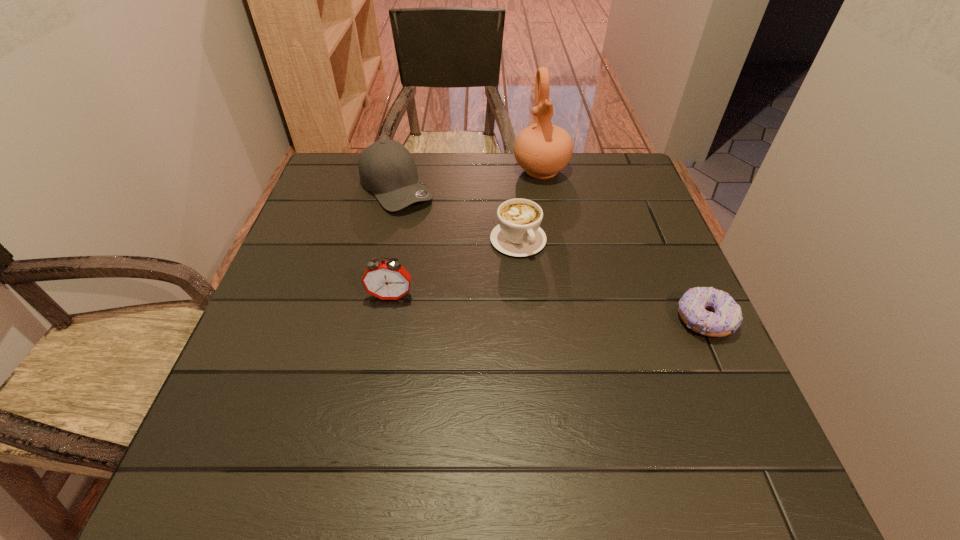
At what (x,y) coordinates should I click in order to perform the action: click on object that is positioned at the left edge. Please return your answer as a coordinate pair (x, y). The height and width of the screenshot is (540, 960). Looking at the image, I should click on (387, 169).

Where is `object that is at the right edge`? object that is at the right edge is located at coordinates (725, 317).

Image resolution: width=960 pixels, height=540 pixels. Identify the location of object present at the far left corner. (387, 169).

Locate an element on the screen. free space at the near edge is located at coordinates (571, 413).

The width and height of the screenshot is (960, 540). In the image, there is a desktop. What are the coordinates of `blank space at the left edge` in the screenshot? It's located at (271, 364).

The width and height of the screenshot is (960, 540). What are the coordinates of `vacant area at the right edge of the desktop` in the screenshot? It's located at pyautogui.click(x=666, y=233).

The height and width of the screenshot is (540, 960). In order to click on blank space at the near left corner in this screenshot , I will do `click(269, 391)`.

Find the location of a particular element. This screenshot has height=540, width=960. vacant space at the far right corner is located at coordinates (596, 176).

Find the location of a particular element. The width and height of the screenshot is (960, 540). free space at the near right corner of the desktop is located at coordinates (746, 408).

I want to click on free area in between the alarm clock and the pottery, so (466, 233).